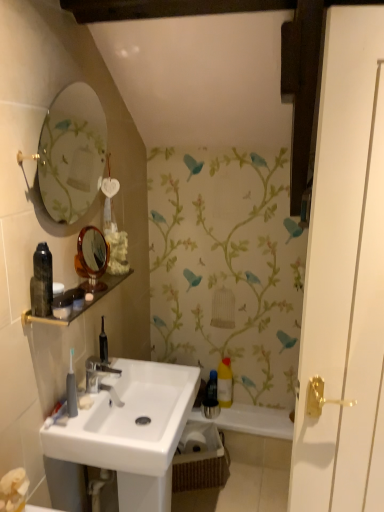
Question: From the image's perspective, is silver metallic faucet at center located beneath white glossy door at right?

Choices:
 (A) yes
 (B) no

Answer: (A)

Question: Is silver metallic faucet at center outside white glossy door at right?

Choices:
 (A) no
 (B) yes

Answer: (B)

Question: Is silver metallic faucet at center bigger than white glossy door at right?

Choices:
 (A) yes
 (B) no

Answer: (B)

Question: Does silver metallic faucet at center have a smaller size compared to white glossy door at right?

Choices:
 (A) yes
 (B) no

Answer: (A)

Question: Considering the relative sizes of silver metallic faucet at center and white glossy door at right in the image provided, is silver metallic faucet at center shorter than white glossy door at right?

Choices:
 (A) no
 (B) yes

Answer: (B)

Question: Is yellow plastic bottle at center inside the boundaries of white glossy bath at lower right, or outside?

Choices:
 (A) inside
 (B) outside

Answer: (B)

Question: From the image's perspective, is yellow plastic bottle at center located above or below white glossy bath at lower right?

Choices:
 (A) below
 (B) above

Answer: (B)

Question: Is point (231, 397) positioned closer to the camera than point (231, 426)?

Choices:
 (A) farther
 (B) closer

Answer: (A)

Question: Is yellow plastic bottle at center to the left or to the right of white glossy bath at lower right in the image?

Choices:
 (A) right
 (B) left

Answer: (B)

Question: Is yellow plastic bottle at center situated inside orange-brown wooden mirror at upper left or outside?

Choices:
 (A) inside
 (B) outside

Answer: (B)

Question: Relative to orange-brown wooden mirror at upper left, is yellow plastic bottle at center in front or behind?

Choices:
 (A) behind
 (B) front

Answer: (A)

Question: From a real-world perspective, is yellow plastic bottle at center physically located above or below orange-brown wooden mirror at upper left?

Choices:
 (A) below
 (B) above

Answer: (A)

Question: From the image's perspective, is yellow plastic bottle at center above or below orange-brown wooden mirror at upper left?

Choices:
 (A) below
 (B) above

Answer: (A)

Question: Considering the positions of woven brown basket at lower center and black glass shelf at upper left in the image, is woven brown basket at lower center wider or thinner than black glass shelf at upper left?

Choices:
 (A) wide
 (B) thin

Answer: (A)

Question: In terms of size, does woven brown basket at lower center appear bigger or smaller than black glass shelf at upper left?

Choices:
 (A) big
 (B) small

Answer: (A)